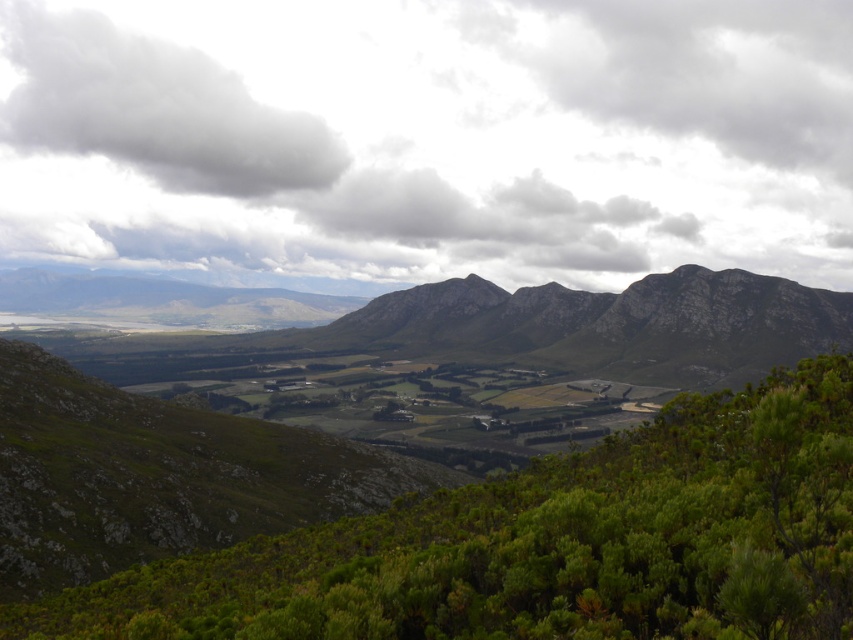
Can you confirm if green leafy shrub at lower center is positioned to the left of green rough rock at center?

Incorrect, green leafy shrub at lower center is not on the left side of green rough rock at center.

Find the location of a particular element. green leafy shrub at lower center is located at coordinates (547, 545).

Does cloudy sky at upper center appear on the right side of white fluffy cloud at upper left?

Correct, you'll find cloudy sky at upper center to the right of white fluffy cloud at upper left.

Is cloudy sky at upper center closer to the viewer compared to white fluffy cloud at upper left?

Yes, cloudy sky at upper center is in front of white fluffy cloud at upper left.

Locate an element on the screen. cloudy sky at upper center is located at coordinates 426,140.

How far apart are green leafy shrub at lower center and white fluffy cloud at upper left?

green leafy shrub at lower center is 713.37 meters from white fluffy cloud at upper left.

Who is higher up, green leafy shrub at lower center or white fluffy cloud at upper left?

white fluffy cloud at upper left is higher up.

Who is more distant from viewer, (820,580) or (32,26)?

Positioned behind is point (32,26).

At what (x,y) coordinates should I click in order to perform the action: click on green leafy shrub at lower center. Please return your answer as a coordinate pair (x, y). The height and width of the screenshot is (640, 853). Looking at the image, I should click on (547, 545).